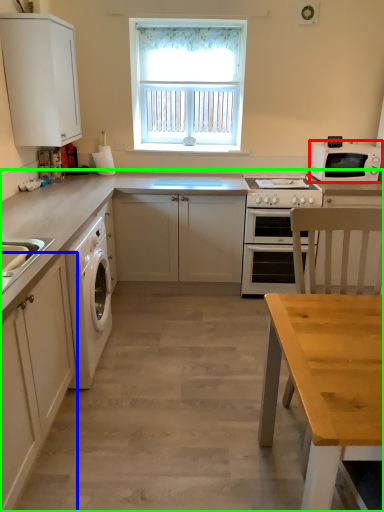
Question: Considering the real-world distances, which object is farthest from kitchen appliance (highlighted by a red box)? cabinetry (highlighted by a blue box) or countertop (highlighted by a green box)?

Choices:
 (A) cabinetry
 (B) countertop

Answer: (A)